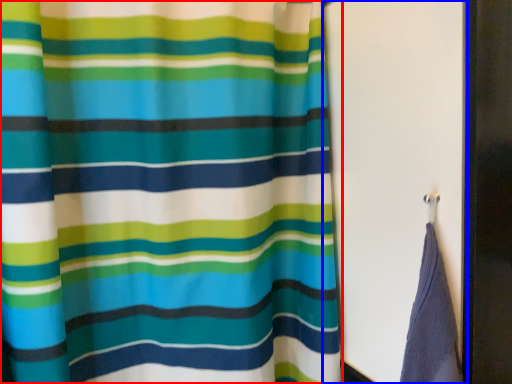
Question: Which of the following is the closest to the observer, curtain (highlighted by a red box) or screen door (highlighted by a blue box)?

Choices:
 (A) curtain
 (B) screen door

Answer: (A)